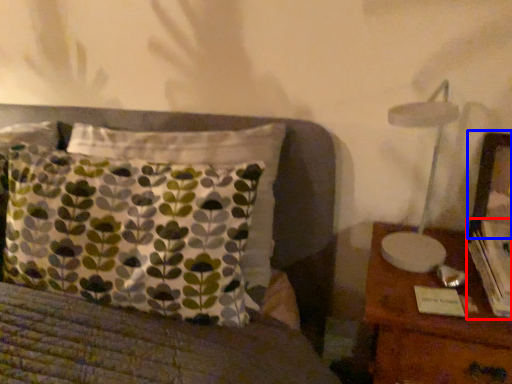
Question: Among these objects, which one is nearest to the camera, book (highlighted by a red box) or picture frame (highlighted by a blue box)?

Choices:
 (A) book
 (B) picture frame

Answer: (A)